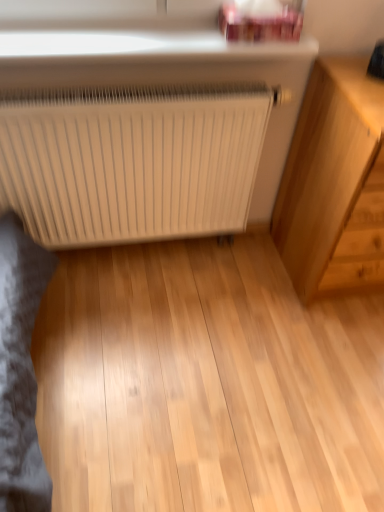
Question: From the image's perspective, is white matte radiator at center above light wood chest of drawers at right?

Choices:
 (A) no
 (B) yes

Answer: (A)

Question: Is white matte radiator at center located outside light wood chest of drawers at right?

Choices:
 (A) no
 (B) yes

Answer: (B)

Question: Considering the relative sizes of white matte radiator at center and light wood chest of drawers at right in the image provided, is white matte radiator at center smaller than light wood chest of drawers at right?

Choices:
 (A) yes
 (B) no

Answer: (A)

Question: Can you confirm if white matte radiator at center is positioned to the left of light wood chest of drawers at right?

Choices:
 (A) yes
 (B) no

Answer: (A)

Question: Are white matte radiator at center and light wood chest of drawers at right far apart?

Choices:
 (A) no
 (B) yes

Answer: (A)

Question: From the image's perspective, is white matte radiator at center under light wood chest of drawers at right?

Choices:
 (A) yes
 (B) no

Answer: (A)

Question: From the image's perspective, would you say light wood chest of drawers at right is positioned over white matte radiator at center?

Choices:
 (A) no
 (B) yes

Answer: (B)

Question: Is light wood chest of drawers at right shorter than white matte radiator at center?

Choices:
 (A) yes
 (B) no

Answer: (B)

Question: Is light wood chest of drawers at right positioned with its back to white matte radiator at center?

Choices:
 (A) yes
 (B) no

Answer: (B)

Question: Is light wood chest of drawers at right bigger than white matte radiator at center?

Choices:
 (A) yes
 (B) no

Answer: (A)

Question: Does light wood chest of drawers at right have a greater width compared to white matte radiator at center?

Choices:
 (A) yes
 (B) no

Answer: (A)

Question: From a real-world perspective, is light wood chest of drawers at right beneath white matte radiator at center?

Choices:
 (A) no
 (B) yes

Answer: (A)

Question: Considering the positions of point (311, 103) and point (233, 220), is point (311, 103) closer or farther from the camera than point (233, 220)?

Choices:
 (A) closer
 (B) farther

Answer: (A)